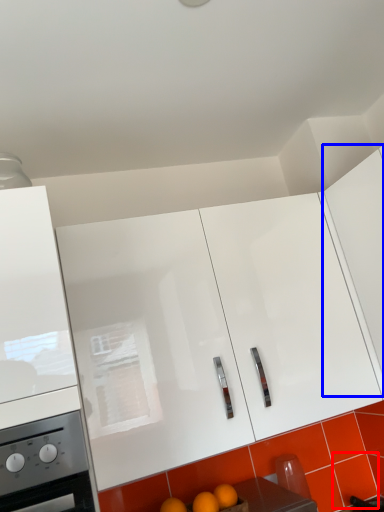
Question: Among these objects, which one is farthest to the camera, tile (highlighted by a red box) or cabinetry (highlighted by a blue box)?

Choices:
 (A) tile
 (B) cabinetry

Answer: (A)